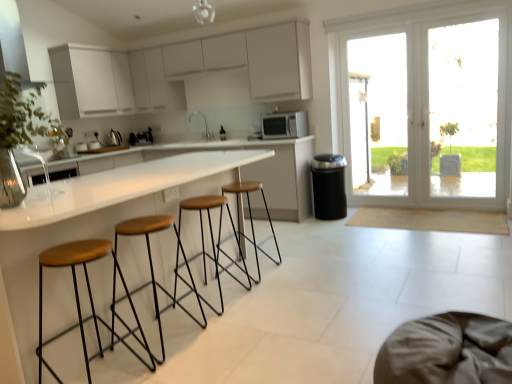
Question: Is metallic silver vent at upper left thinner than brown fabric swivel chair at lower right?

Choices:
 (A) yes
 (B) no

Answer: (A)

Question: Does metallic silver vent at upper left have a greater width compared to brown fabric swivel chair at lower right?

Choices:
 (A) yes
 (B) no

Answer: (B)

Question: From the image's perspective, would you say metallic silver vent at upper left is positioned over brown fabric swivel chair at lower right?

Choices:
 (A) no
 (B) yes

Answer: (B)

Question: Is metallic silver vent at upper left to the right of brown fabric swivel chair at lower right from the viewer's perspective?

Choices:
 (A) no
 (B) yes

Answer: (A)

Question: From a real-world perspective, is metallic silver vent at upper left located higher than brown fabric swivel chair at lower right?

Choices:
 (A) yes
 (B) no

Answer: (A)

Question: Considering the relative sizes of metallic silver vent at upper left and brown fabric swivel chair at lower right in the image provided, is metallic silver vent at upper left bigger than brown fabric swivel chair at lower right?

Choices:
 (A) yes
 (B) no

Answer: (A)

Question: Considering the relative sizes of white matte microwave at center, placed as the first appliance when sorted from right to left, and metallic silver kettle at center, the first appliance in the back-to-front sequence, in the image provided, is white matte microwave at center, placed as the first appliance when sorted from right to left, bigger than metallic silver kettle at center, the first appliance in the back-to-front sequence,?

Choices:
 (A) yes
 (B) no

Answer: (A)

Question: From the image's perspective, is white matte microwave at center, placed as the first appliance when sorted from right to left, under metallic silver kettle at center, the second appliance positioned from the front?

Choices:
 (A) no
 (B) yes

Answer: (A)

Question: From the image's perspective, is white matte microwave at center, placed as the first appliance when sorted from right to left, on top of metallic silver kettle at center, positioned as the first appliance in left-to-right order?

Choices:
 (A) yes
 (B) no

Answer: (A)

Question: Can you confirm if white matte microwave at center, which is counted as the 1th appliance, starting from the front, is wider than metallic silver kettle at center, arranged as the 2th appliance when viewed from the right?

Choices:
 (A) no
 (B) yes

Answer: (B)

Question: From a real-world perspective, is white matte microwave at center, which is counted as the 1th appliance, starting from the front, below metallic silver kettle at center, positioned as the first appliance in left-to-right order?

Choices:
 (A) no
 (B) yes

Answer: (A)

Question: Is white matte microwave at center, which is counted as the 1th appliance, starting from the front, looking in the opposite direction of metallic silver kettle at center, arranged as the 2th appliance when viewed from the right?

Choices:
 (A) no
 (B) yes

Answer: (A)

Question: Is white glossy sink at center facing towards transparent glass door at right?

Choices:
 (A) no
 (B) yes

Answer: (A)